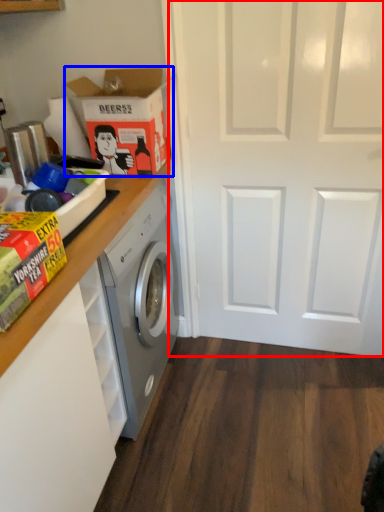
Question: Which object appears farthest to the camera in this image, screen door (highlighted by a red box) or cardboard box (highlighted by a blue box)?

Choices:
 (A) screen door
 (B) cardboard box

Answer: (B)